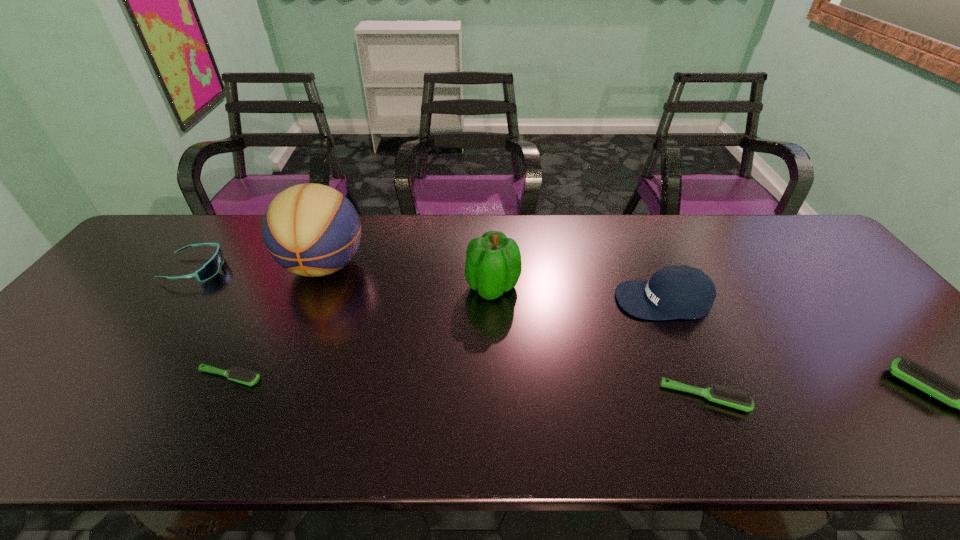
Image resolution: width=960 pixels, height=540 pixels. Identify the location of empty space that is in between the sixth shortest object and the sixth tallest object. 598,342.

Where is `empty space that is in between the second shortest object and the leftmost hairbrush`? The height and width of the screenshot is (540, 960). empty space that is in between the second shortest object and the leftmost hairbrush is located at coordinates (468, 387).

Find the location of a particular element. The image size is (960, 540). vacant space that is in between the bell pepper and the second shortest hairbrush is located at coordinates (598, 342).

The width and height of the screenshot is (960, 540). Find the location of `vacant space that's between the sixth shortest object and the sunglasses`. vacant space that's between the sixth shortest object and the sunglasses is located at coordinates (345, 278).

At what (x,y) coordinates should I click in order to perform the action: click on object that is the fifth nearest to the shortest hairbrush. Please return your answer as a coordinate pair (x, y). The width and height of the screenshot is (960, 540). Looking at the image, I should click on (720, 394).

Find the location of a particular element. This screenshot has width=960, height=540. object that is the second closest to the second tallest object is located at coordinates (312, 230).

At what (x,y) coordinates should I click in order to perform the action: click on hairbrush identified as the closest to the basketball. Please return your answer as a coordinate pair (x, y). Looking at the image, I should click on (248, 377).

Where is `hairbrush that is the second closest to the shortest object`? hairbrush that is the second closest to the shortest object is located at coordinates (940, 387).

Where is `vacant space that satisfies the following two spatial constraints: 1. on the patterned surface of the bell pepper; 2. on the left side of the tallest object`? vacant space that satisfies the following two spatial constraints: 1. on the patterned surface of the bell pepper; 2. on the left side of the tallest object is located at coordinates (316, 287).

You are a GUI agent. You are given a task and a screenshot of the screen. Output one action in this format:
    pyautogui.click(x=<x>, y=<y>)
    Task: Click on the free space in the image that satisfies the following two spatial constraints: 1. on the front-facing side of the sixth tallest object; 2. on the left side of the leftmost object
    
    Given the screenshot: What is the action you would take?
    pyautogui.click(x=103, y=397)